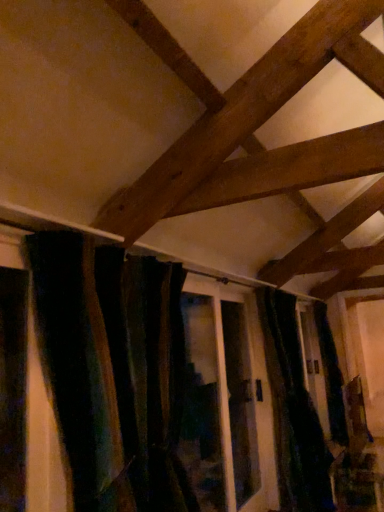
Question: Which direction should I rotate to face velvet dark green curtain at center, which is the second curtain in left-to-right order, — up or down?

Choices:
 (A) up
 (B) down

Answer: (B)

Question: Is velvet dark green curtain at center, acting as the second curtain starting from the front, touching translucent glass screen door at center?

Choices:
 (A) no
 (B) yes

Answer: (A)

Question: Is velvet dark green curtain at center, which is the second curtain in left-to-right order, smaller than translucent glass screen door at center?

Choices:
 (A) yes
 (B) no

Answer: (B)

Question: Is velvet dark green curtain at center, acting as the second curtain starting from the front, not inside translucent glass screen door at center?

Choices:
 (A) no
 (B) yes

Answer: (B)

Question: Is velvet dark green curtain at center, acting as the second curtain starting from the front, to the right of translucent glass screen door at center from the viewer's perspective?

Choices:
 (A) yes
 (B) no

Answer: (A)

Question: Is velvet dark green curtain at center, acting as the second curtain starting from the front, shorter than translucent glass screen door at center?

Choices:
 (A) no
 (B) yes

Answer: (A)

Question: Is translucent glass screen door at center positioned far away from velvet dark green curtain at center, which is the second curtain in left-to-right order?

Choices:
 (A) no
 (B) yes

Answer: (A)

Question: Is translucent glass screen door at center behind velvet dark green curtain at center, acting as the second curtain starting from the front?

Choices:
 (A) yes
 (B) no

Answer: (B)

Question: Does translucent glass screen door at center have a greater width compared to velvet dark green curtain at center, acting as the second curtain starting from the front?

Choices:
 (A) no
 (B) yes

Answer: (A)

Question: Is translucent glass screen door at center in contact with velvet dark green curtain at center, the 1th curtain viewed from the right?

Choices:
 (A) no
 (B) yes

Answer: (A)

Question: From the image's perspective, is translucent glass screen door at center below velvet dark green curtain at center, the 1th curtain viewed from the right?

Choices:
 (A) yes
 (B) no

Answer: (B)

Question: Is translucent glass screen door at center aimed at velvet dark green curtain at center, which ranks as the first curtain in back-to-front order?

Choices:
 (A) no
 (B) yes

Answer: (A)

Question: Are velvet dark green curtain at center, the 1th curtain positioned from the front, and translucent glass screen door at center making contact?

Choices:
 (A) no
 (B) yes

Answer: (A)